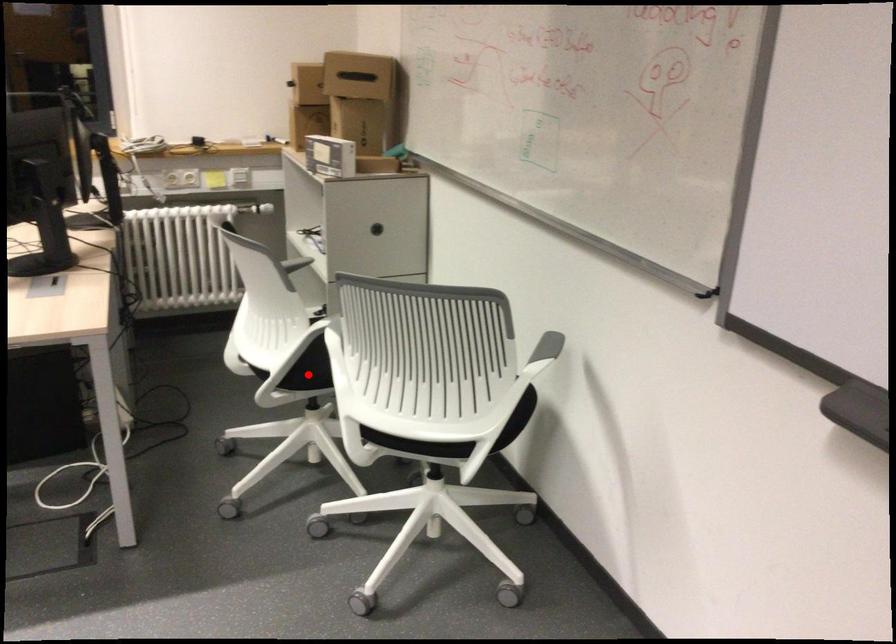
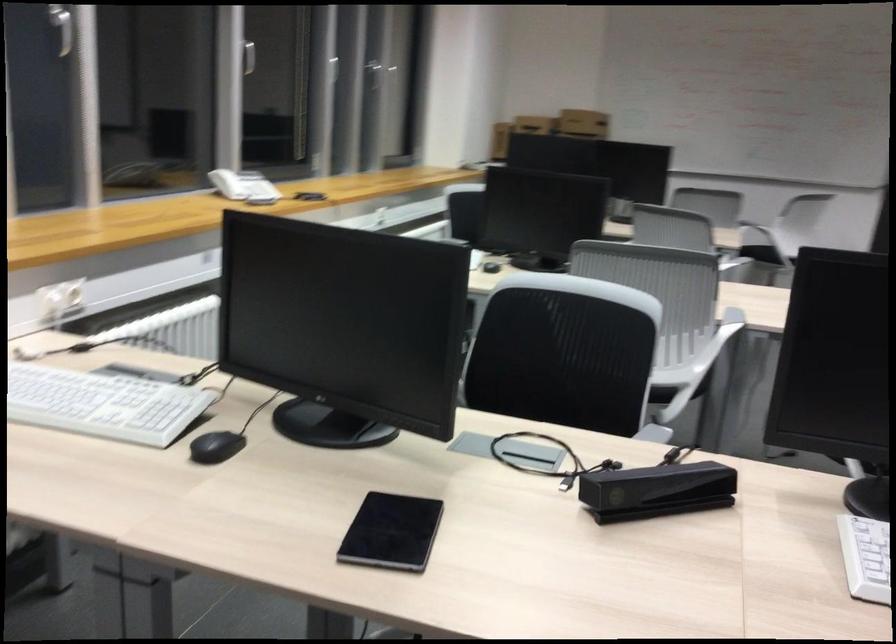
Question: I am providing you with two images of the same scene from different viewpoints. A red point is marked on the first image. At the location where the point appears in image 1, is it still visible in image 2?

Choices:
 (A) Yes
 (B) No

Answer: (B)